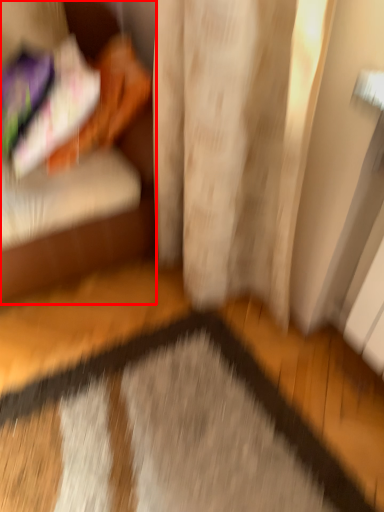
Question: From the image's perspective, what is the correct spatial positioning of furniture (annotated by the red box) in reference to doormat?

Choices:
 (A) above
 (B) below

Answer: (A)